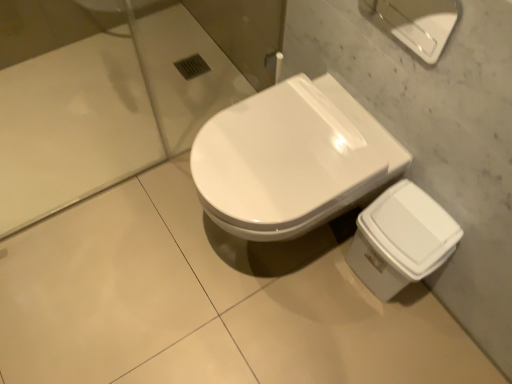
Question: Visually, is white glossy trash can at lower right, the 1th porcelain from the bottom, positioned to the left or to the right of white glossy porcelain at upper right, the first porcelain when ordered from top to bottom?

Choices:
 (A) right
 (B) left

Answer: (A)

Question: Is white glossy trash can at lower right, which is the 2th porcelain in front-to-back order, spatially inside white glossy porcelain at upper right, which is the second porcelain from bottom to top, or outside of it?

Choices:
 (A) outside
 (B) inside

Answer: (A)

Question: Which object is the farthest from the white glossy trash can at lower right, which is the 2th porcelain in front-to-back order?

Choices:
 (A) white glossy porcelain at upper right, the first porcelain when ordered from top to bottom
 (B) white glossy toilet at center

Answer: (A)

Question: Based on their relative distances, which object is nearer to the white glossy porcelain at upper right, which is the second porcelain from bottom to top?

Choices:
 (A) white glossy trash can at lower right, the first porcelain positioned from the back
 (B) white glossy toilet at center

Answer: (B)